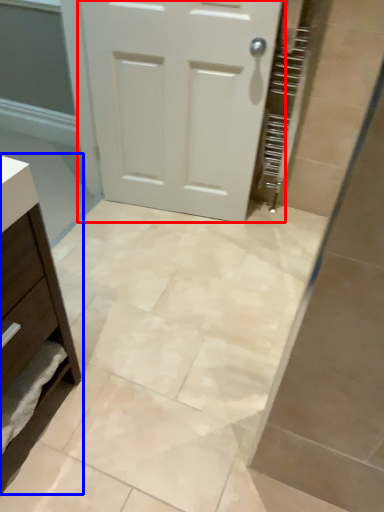
Question: Among these objects, which one is nearest to the camera, door (highlighted by a red box) or chest of drawers (highlighted by a blue box)?

Choices:
 (A) door
 (B) chest of drawers

Answer: (B)